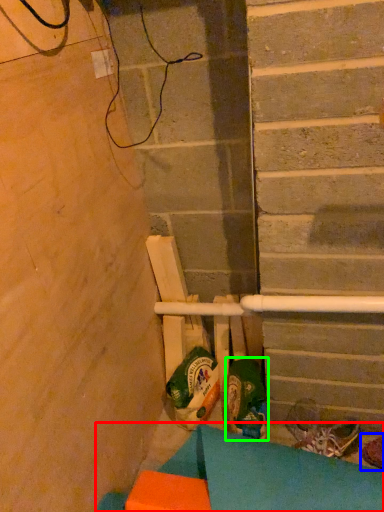
Question: Considering the real-world distances, which object is farthest from furniture (highlighted by a red box)? footwear (highlighted by a blue box) or footwear (highlighted by a green box)?

Choices:
 (A) footwear
 (B) footwear

Answer: (A)